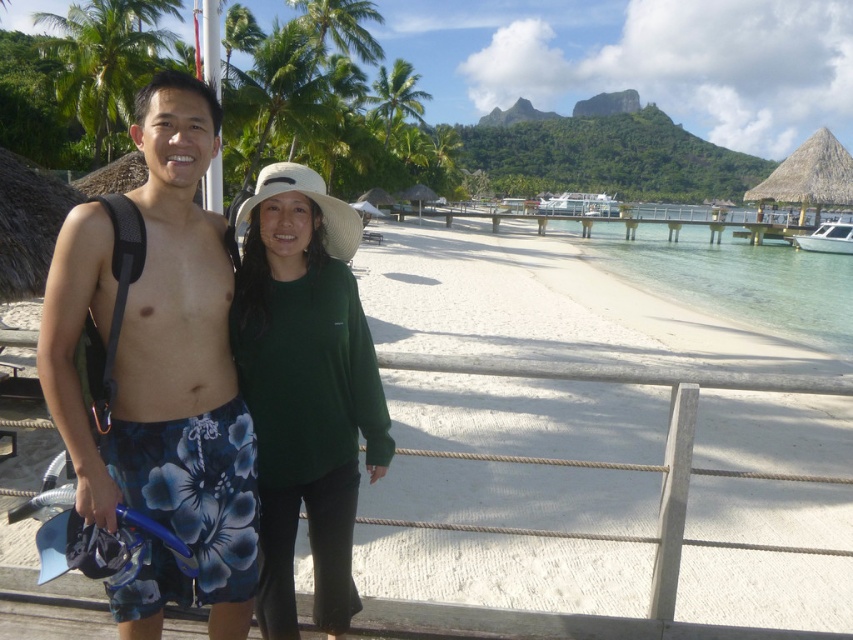
You are a photographer trying to capture the green matte hat at center and the white glossy boat at right in the same frame. Which object should you focus on first if you want to ensure both are in focus, considering their sizes?

The green matte hat at center is thinner than the white glossy boat at right, so you should focus on the white glossy boat at right first since it is larger and might require more precise focusing to ensure both are sharp.

You are a photographer trying to capture a photo of the white glossy boat at right while ensuring the green matte hat at center is also in the frame. Based on their positions, will you be able to include both in your shot?

The green matte hat at center is to the left of the white glossy boat at right, so yes, both can be captured in the same frame as they are positioned side by side horizontally.